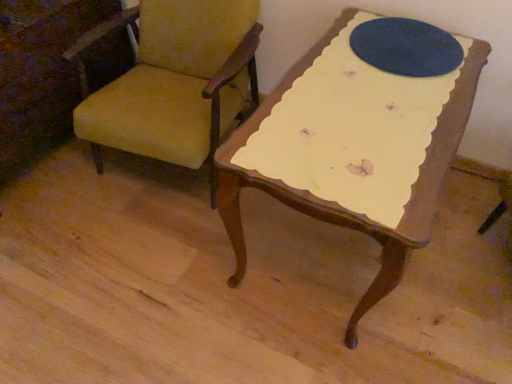
I want to click on blank space above blue felt oval at upper center (from a real-world perspective), so click(x=421, y=37).